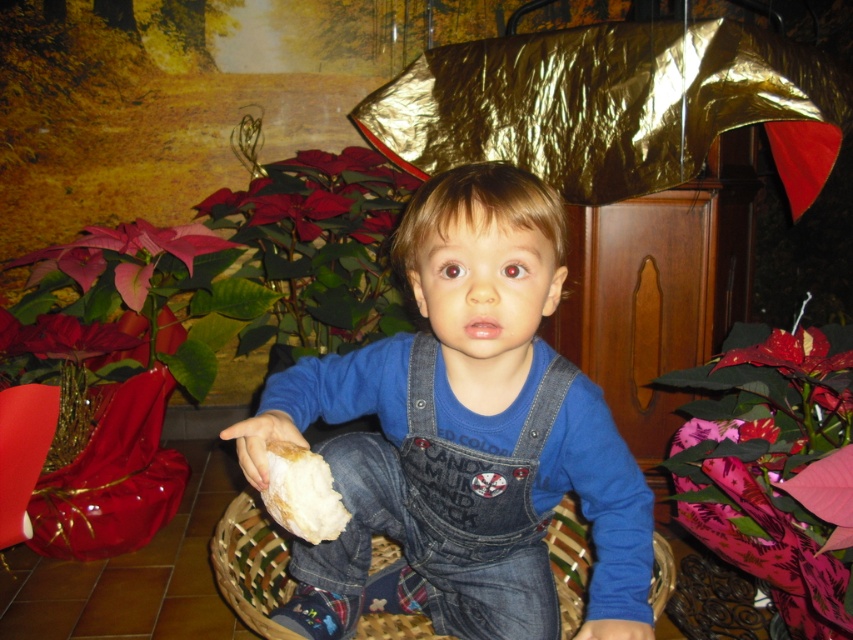
Between denim overalls at center and white crumbly bread at center, which one has less height?

white crumbly bread at center is shorter.

Does denim overalls at center appear over white crumbly bread at center?

No.

Is point (453, 552) positioned before point (310, 516)?

No.

This screenshot has height=640, width=853. Find the location of `denim overalls at center`. denim overalls at center is located at coordinates (465, 433).

Is point (657, 596) positioned before point (271, 474)?

That is False.

Does point (273, 608) come closer to viewer compared to point (312, 515)?

No, (273, 608) is further to viewer.

Locate an element on the screen. This screenshot has width=853, height=640. woven wood basket at center is located at coordinates [x=252, y=563].

Who is positioned more to the left, denim overalls at center or woven wood basket at center?

woven wood basket at center

Does denim overalls at center lie behind woven wood basket at center?

No, denim overalls at center is closer to the viewer.

Describe the element at coordinates (465, 433) in the screenshot. I see `denim overalls at center` at that location.

Where is `denim overalls at center`? denim overalls at center is located at coordinates (465, 433).